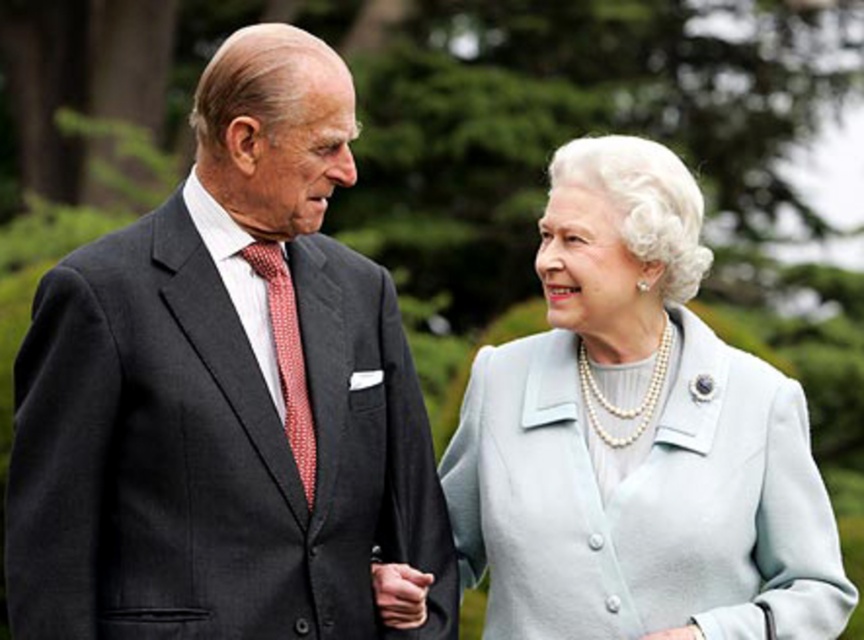
Question: Considering the relative positions of dark gray suit at left and light blue fabric coat at center in the image provided, where is dark gray suit at left located with respect to light blue fabric coat at center?

Choices:
 (A) above
 (B) below

Answer: (A)

Question: Does dark gray suit at left appear under light blue fabric coat at center?

Choices:
 (A) no
 (B) yes

Answer: (A)

Question: Which point appears closest to the camera in this image?

Choices:
 (A) (118, 624)
 (B) (791, 432)

Answer: (A)

Question: Which of the following is the farthest from the observer?

Choices:
 (A) light blue fabric coat at center
 (B) dark gray suit at left

Answer: (A)

Question: Is dark gray suit at left positioned at the back of light blue fabric coat at center?

Choices:
 (A) no
 (B) yes

Answer: (A)